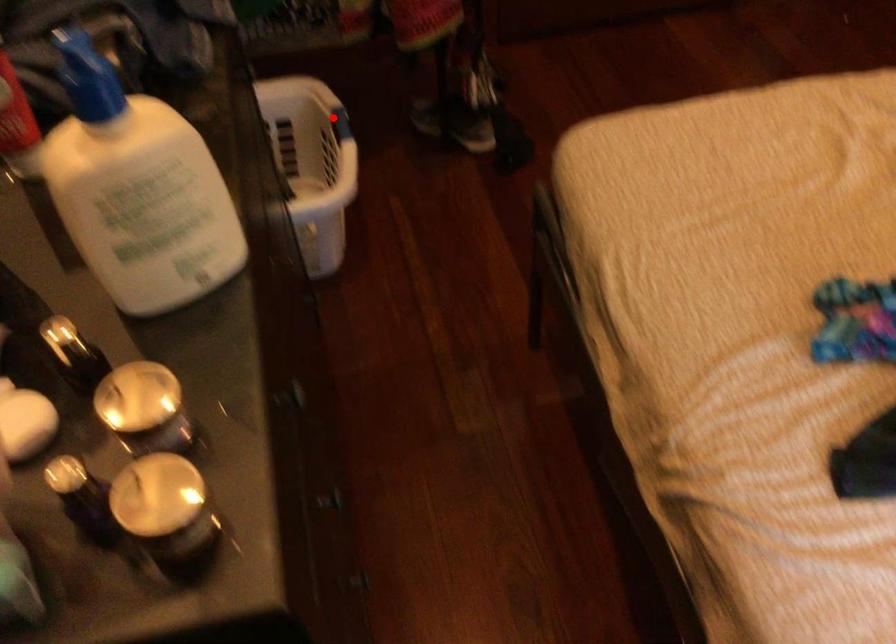
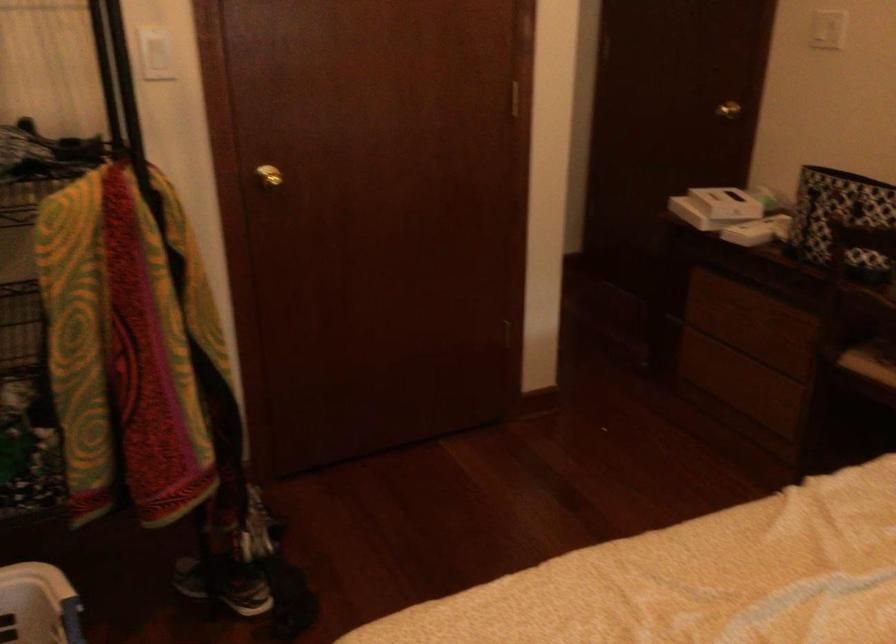
The point at the highlighted location is marked in the first image. Where is the corresponding point in the second image?

(63, 616)